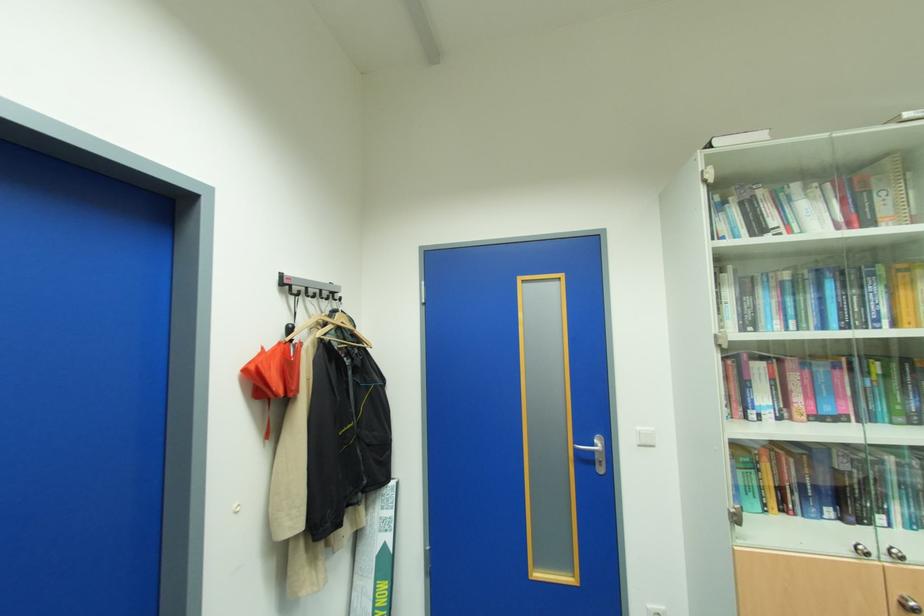
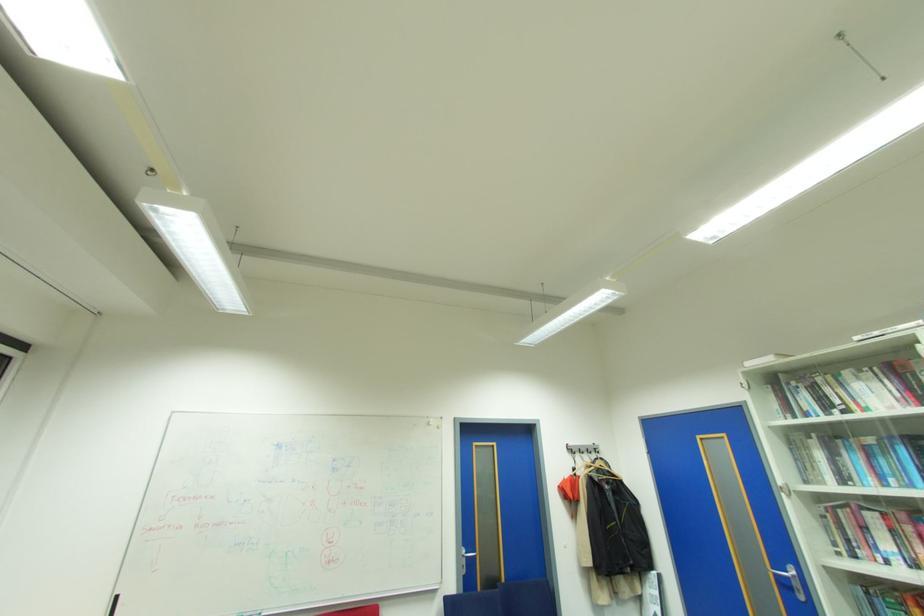
Where in the second image is the point corresponding to pixel 597 451 from the first image?

(791, 578)